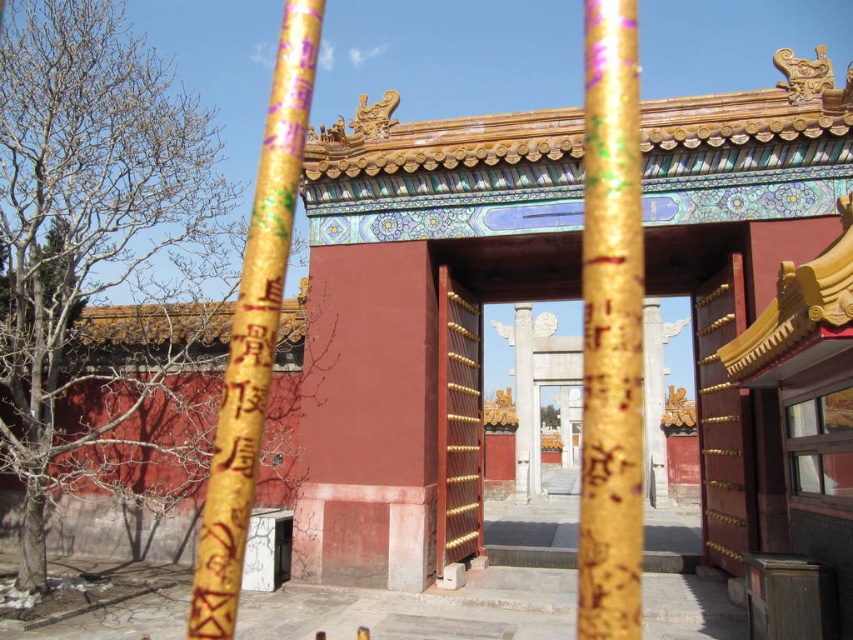
Can you confirm if gold glittering pole at center is positioned to the right of gold painted wooden pole at center?

Correct, you'll find gold glittering pole at center to the right of gold painted wooden pole at center.

Between gold glittering pole at center and gold painted wooden pole at center, which one is positioned higher?

gold painted wooden pole at center is above.

Find the location of a particular element. The height and width of the screenshot is (640, 853). gold glittering pole at center is located at coordinates (611, 330).

Is gold painted wooden pole at center thinner than smooth wood gate at center?

Yes, gold painted wooden pole at center is thinner than smooth wood gate at center.

Who is positioned more to the left, gold painted wooden pole at center or smooth wood gate at center?

gold painted wooden pole at center

The image size is (853, 640). Describe the element at coordinates (254, 330) in the screenshot. I see `gold painted wooden pole at center` at that location.

This screenshot has width=853, height=640. What are the coordinates of `gold painted wooden pole at center` in the screenshot? It's located at (254, 330).

Who is lower down, gold glittering pole at center or smooth wood gate at center?

smooth wood gate at center is below.

Image resolution: width=853 pixels, height=640 pixels. Describe the element at coordinates (611, 330) in the screenshot. I see `gold glittering pole at center` at that location.

What do you see at coordinates (611, 330) in the screenshot?
I see `gold glittering pole at center` at bounding box center [611, 330].

Locate an element on the screen. The height and width of the screenshot is (640, 853). gold glittering pole at center is located at coordinates (611, 330).